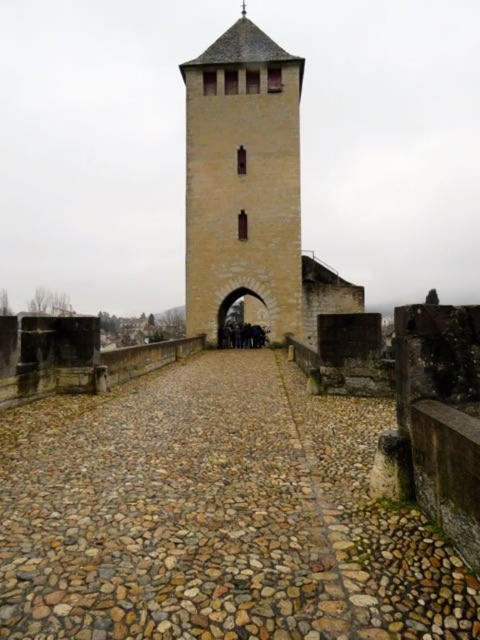
Question: Can you confirm if brown cobblestone path at center is positioned to the left of smooth stone tower at center?

Choices:
 (A) yes
 (B) no

Answer: (A)

Question: Is brown cobblestone path at center above smooth stone tower at center?

Choices:
 (A) yes
 (B) no

Answer: (B)

Question: Is brown cobblestone path at center to the right of smooth stone tower at center from the viewer's perspective?

Choices:
 (A) yes
 (B) no

Answer: (B)

Question: Which point appears closest to the camera in this image?

Choices:
 (A) (188, 116)
 (B) (172, 499)

Answer: (B)

Question: Which object is farther from the camera taking this photo?

Choices:
 (A) brown cobblestone path at center
 (B) smooth stone tower at center

Answer: (B)